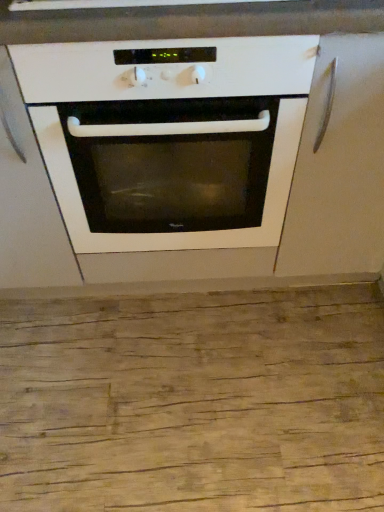
Measure the distance between point (306, 264) and camera.

The distance of point (306, 264) from camera is 1.33 meters.

Where is `matte white cabinet at right, the first cabinetry from the right`? This screenshot has width=384, height=512. matte white cabinet at right, the first cabinetry from the right is located at coordinates tap(339, 166).

Image resolution: width=384 pixels, height=512 pixels. Describe the element at coordinates (28, 204) in the screenshot. I see `white matte cabinet at center, arranged as the 2th cabinetry when viewed from the right` at that location.

Where is `matte white cabinet at right, which is the second cabinetry in left-to-right order`? matte white cabinet at right, which is the second cabinetry in left-to-right order is located at coordinates (339, 166).

Which of these two, white matte cabinet at center, arranged as the 2th cabinetry when viewed from the right, or white glossy oven at center, stands taller?

white glossy oven at center.

Does white matte cabinet at center, arranged as the 2th cabinetry when viewed from the right, come in front of white glossy oven at center?

No, white matte cabinet at center, arranged as the 2th cabinetry when viewed from the right, is behind white glossy oven at center.

Is white glossy oven at center located within white matte cabinet at center, arranged as the 2th cabinetry when viewed from the right?

No, white matte cabinet at center, arranged as the 2th cabinetry when viewed from the right, does not contain white glossy oven at center.

Considering the relative positions of white glossy oven at center and matte white cabinet at right, which is the second cabinetry in left-to-right order, in the image provided, is white glossy oven at center to the left or to the right of matte white cabinet at right, which is the second cabinetry in left-to-right order,?

white glossy oven at center is to the left of matte white cabinet at right, which is the second cabinetry in left-to-right order.

Would you say white glossy oven at center is outside matte white cabinet at right, which is the second cabinetry in left-to-right order?

white glossy oven at center lies outside matte white cabinet at right, which is the second cabinetry in left-to-right order,'s area.

From the image's perspective, is white glossy oven at center positioned above or below matte white cabinet at right, which is the second cabinetry in left-to-right order?

Clearly, from the image's perspective, white glossy oven at center is below matte white cabinet at right, which is the second cabinetry in left-to-right order.

Is white glossy oven at center in front of or behind matte white cabinet at right, which is the second cabinetry in left-to-right order, in the image?

white glossy oven at center is positioned closer to the viewer than matte white cabinet at right, which is the second cabinetry in left-to-right order.

Which of these two, white glossy oven at center or white matte cabinet at center, the first cabinetry from the left, is bigger?

Bigger between the two is white glossy oven at center.

Find the location of `oven in front of the white matte cabinet at center, the first cabinetry from the left`. oven in front of the white matte cabinet at center, the first cabinetry from the left is located at coordinates (169, 137).

Considering the positions of objects white glossy oven at center and white matte cabinet at center, arranged as the 2th cabinetry when viewed from the right, in the image provided, who is more to the right, white glossy oven at center or white matte cabinet at center, arranged as the 2th cabinetry when viewed from the right,?

white glossy oven at center is more to the right.

From a real-world perspective, which object rests below the other?

white glossy oven at center.

Does point (289, 197) come closer to viewer compared to point (254, 144)?

That is False.

Can you confirm if matte white cabinet at right, which is the second cabinetry in left-to-right order, is shorter than white glossy oven at center?

Yes.

Are matte white cabinet at right, which is the second cabinetry in left-to-right order, and white glossy oven at center beside each other?

matte white cabinet at right, which is the second cabinetry in left-to-right order, and white glossy oven at center are clearly separated.

Is white matte cabinet at center, arranged as the 2th cabinetry when viewed from the right, turned away from matte white cabinet at right, the first cabinetry from the right?

No, white matte cabinet at center, arranged as the 2th cabinetry when viewed from the right,'s orientation is not away from matte white cabinet at right, the first cabinetry from the right.

From a real-world perspective, who is located higher, white matte cabinet at center, the first cabinetry from the left, or matte white cabinet at right, the first cabinetry from the right?

matte white cabinet at right, the first cabinetry from the right, from a real-world perspective.

Identify the location of cabinetry on the right side of white matte cabinet at center, the first cabinetry from the left. (339, 166).

In the image, is white matte cabinet at center, the first cabinetry from the left, positioned in front of or behind matte white cabinet at right, which is the second cabinetry in left-to-right order?

white matte cabinet at center, the first cabinetry from the left, is positioned closer to the viewer than matte white cabinet at right, which is the second cabinetry in left-to-right order.

Considering the positions of objects matte white cabinet at right, which is the second cabinetry in left-to-right order, and white matte cabinet at center, arranged as the 2th cabinetry when viewed from the right, in the image provided, who is more to the left, matte white cabinet at right, which is the second cabinetry in left-to-right order, or white matte cabinet at center, arranged as the 2th cabinetry when viewed from the right,?

white matte cabinet at center, arranged as the 2th cabinetry when viewed from the right.

This screenshot has height=512, width=384. Find the location of `cabinetry below the matte white cabinet at right, which is the second cabinetry in left-to-right order (from the image's perspective)`. cabinetry below the matte white cabinet at right, which is the second cabinetry in left-to-right order (from the image's perspective) is located at coordinates pyautogui.click(x=28, y=204).

What's the angular difference between matte white cabinet at right, which is the second cabinetry in left-to-right order, and white matte cabinet at center, the first cabinetry from the left,'s facing directions?

0.000157 degrees separate the facing orientations of matte white cabinet at right, which is the second cabinetry in left-to-right order, and white matte cabinet at center, the first cabinetry from the left.

Which object is further away from the camera, matte white cabinet at right, the first cabinetry from the right, or white matte cabinet at center, the first cabinetry from the left?

Positioned behind is matte white cabinet at right, the first cabinetry from the right.

This screenshot has height=512, width=384. Identify the location of oven in front of the white matte cabinet at center, arranged as the 2th cabinetry when viewed from the right. (169, 137).

Locate an element on the screen. This screenshot has height=512, width=384. oven on the left of matte white cabinet at right, which is the second cabinetry in left-to-right order is located at coordinates (169, 137).

When comparing their distances from white glossy oven at center, does white matte cabinet at center, the first cabinetry from the left, or matte white cabinet at right, the first cabinetry from the right, seem further?

white matte cabinet at center, the first cabinetry from the left, is further to white glossy oven at center.

Looking at the image, which one is located further to matte white cabinet at right, the first cabinetry from the right, white glossy oven at center or white matte cabinet at center, the first cabinetry from the left?

white matte cabinet at center, the first cabinetry from the left, lies further to matte white cabinet at right, the first cabinetry from the right, than the other object.

Based on their spatial positions, is white matte cabinet at center, arranged as the 2th cabinetry when viewed from the right, or white glossy oven at center further from matte white cabinet at right, which is the second cabinetry in left-to-right order?

white matte cabinet at center, arranged as the 2th cabinetry when viewed from the right, is further to matte white cabinet at right, which is the second cabinetry in left-to-right order.

Looking at the image, which one is located closer to white matte cabinet at center, the first cabinetry from the left, white glossy oven at center or matte white cabinet at right, which is the second cabinetry in left-to-right order?

Among the two, white glossy oven at center is located nearer to white matte cabinet at center, the first cabinetry from the left.

From the picture: From the image, which object appears to be nearer to white glossy oven at center, matte white cabinet at right, the first cabinetry from the right, or white matte cabinet at center, arranged as the 2th cabinetry when viewed from the right?

matte white cabinet at right, the first cabinetry from the right, is closer to white glossy oven at center.

Estimate the real-world distances between objects in this image. Which object is closer to white matte cabinet at center, arranged as the 2th cabinetry when viewed from the right, matte white cabinet at right, the first cabinetry from the right, or white glossy oven at center?

white glossy oven at center is closer to white matte cabinet at center, arranged as the 2th cabinetry when viewed from the right.

Identify the location of oven between white matte cabinet at center, the first cabinetry from the left, and matte white cabinet at right, the first cabinetry from the right, from left to right. The height and width of the screenshot is (512, 384). (169, 137).